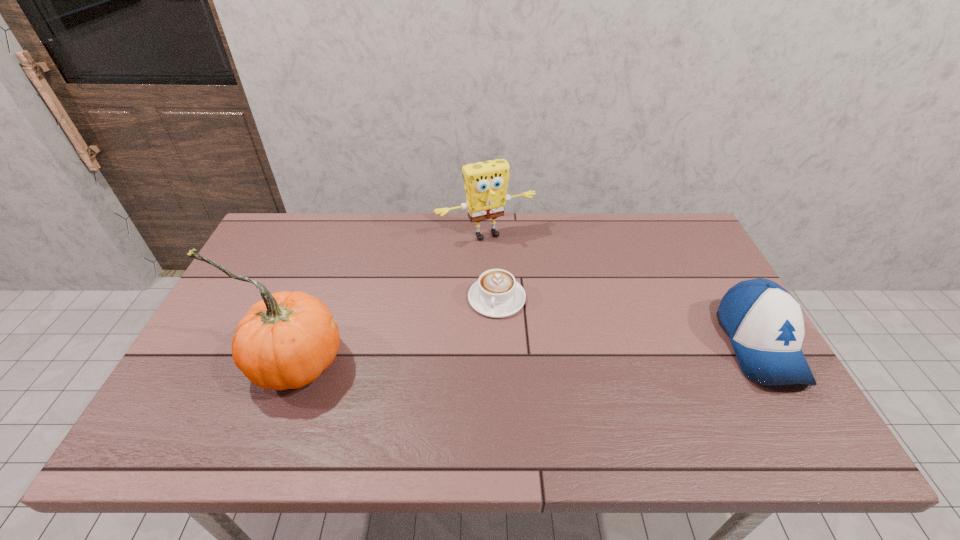
At what (x,y) coordinates should I click in order to perform the action: click on free point located 0.350m on the face of the farthest object. Please return your answer as a coordinate pair (x, y). Looking at the image, I should click on (549, 321).

At what (x,y) coordinates should I click in order to perform the action: click on vacant area situated 0.130m with the handle on the right side of the cappuccino. Please return your answer as a coordinate pair (x, y). The height and width of the screenshot is (540, 960). Looking at the image, I should click on (491, 357).

Where is `blank area located 0.070m with the handle on the right side of the cappuccino`? This screenshot has height=540, width=960. blank area located 0.070m with the handle on the right side of the cappuccino is located at coordinates (492, 339).

Locate an element on the screen. free space located 0.220m with the handle on the right side of the cappuccino is located at coordinates (487, 388).

Where is `object that is at the far edge`? Image resolution: width=960 pixels, height=540 pixels. object that is at the far edge is located at coordinates (485, 183).

I want to click on pumpkin at the near edge, so click(285, 341).

At what (x,y) coordinates should I click in order to perform the action: click on baseball cap positioned at the near edge. Please return your answer as a coordinate pair (x, y). The width and height of the screenshot is (960, 540). Looking at the image, I should click on (764, 322).

Where is `object at the left edge`? The image size is (960, 540). object at the left edge is located at coordinates (285, 341).

The image size is (960, 540). I want to click on object located in the right edge section of the desktop, so (x=764, y=322).

Where is `object that is at the near left corner`? Image resolution: width=960 pixels, height=540 pixels. object that is at the near left corner is located at coordinates (285, 341).